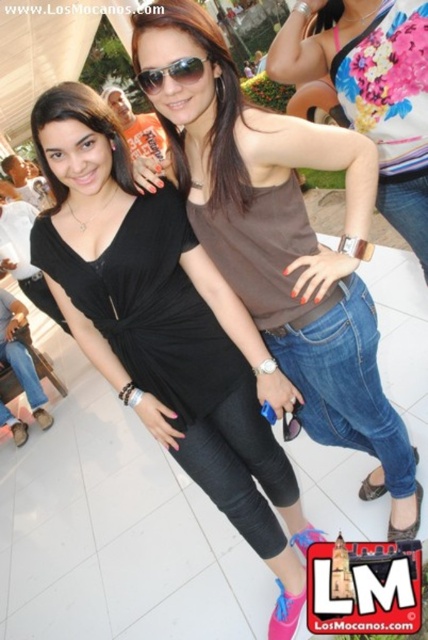
You are a photographer adjusting the camera focus. The camera is currently focused on the woman on the left. To ensure the brown matte tank top at center is in focus, where should you adjust the focus point?

The brown matte tank top at center is located at point [284,243], so you should adjust the focus point to that coordinate to ensure it is in focus.

You are a photographer trying to focus on the brown matte tank top at center. Based on its coordinates, which woman should you adjust your camera to capture?

The brown matte tank top at center is located on the woman on the right, so you should adjust your camera to capture her.